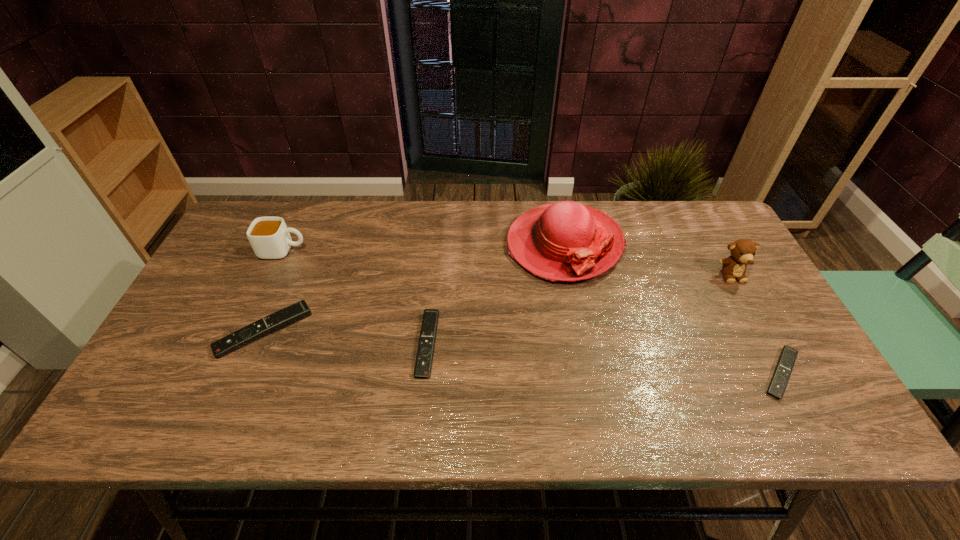
The image size is (960, 540). What are the coordinates of `free space that satisfies the following two spatial constraints: 1. on the front side of the shortest remote control; 2. on the left side of the leftmost remote control` in the screenshot? It's located at (246, 374).

Find the location of `vacant region that satisfies the following two spatial constraints: 1. on the front side of the fourth object from right to left; 2. on the right side of the shortest remote control`. vacant region that satisfies the following two spatial constraints: 1. on the front side of the fourth object from right to left; 2. on the right side of the shortest remote control is located at coordinates (424, 374).

At what (x,y) coordinates should I click in order to perform the action: click on vacant point that satisfies the following two spatial constraints: 1. at the front of the tallest object with a bow; 2. on the side with the handle of the cup. Please return your answer as a coordinate pair (x, y). Looking at the image, I should click on (565, 251).